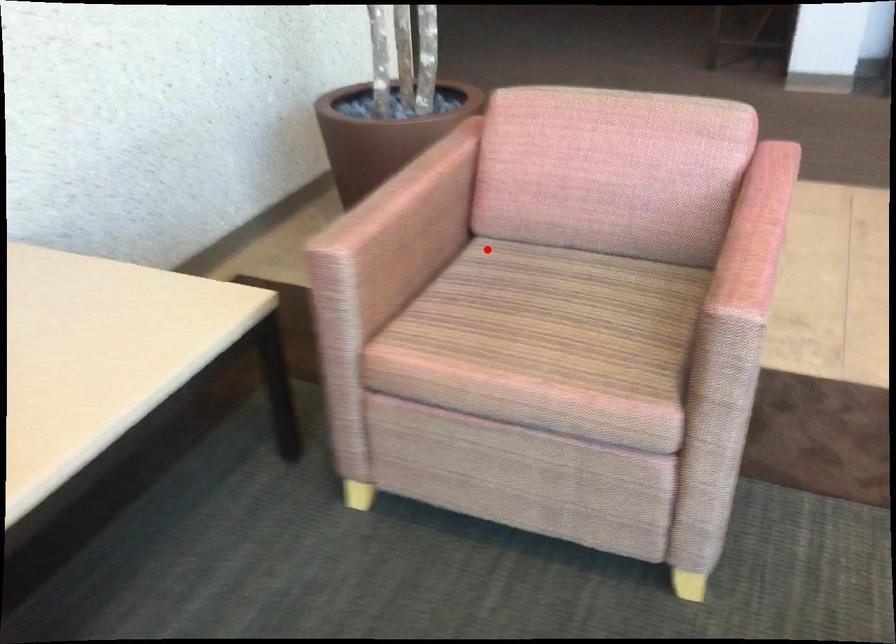
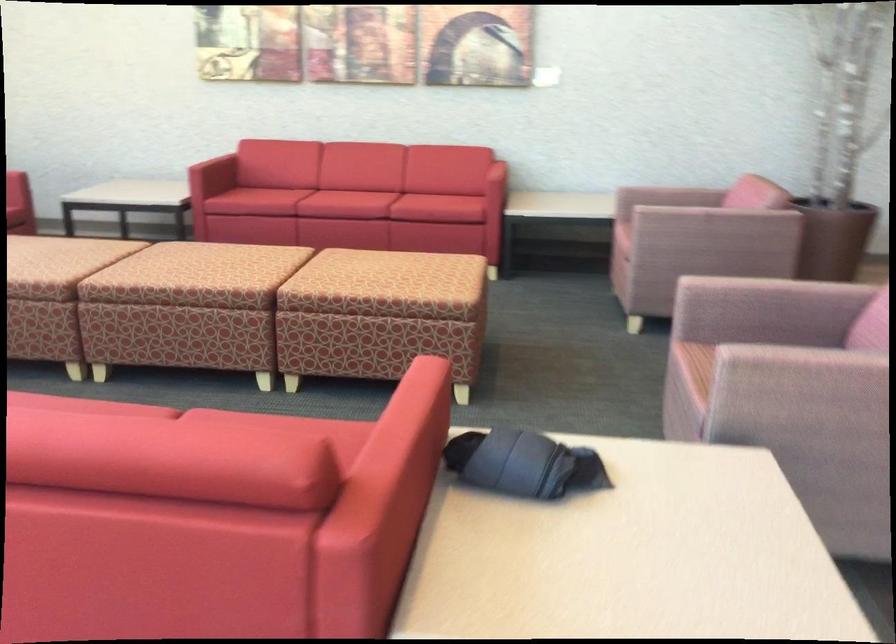
Question: I am providing you with two images of the same scene from different viewpoints. Given a red point in image1, look at the same physical point in image2. Is it:

Choices:
 (A) Closer to the viewpoint
 (B) Farther from the viewpoint

Answer: (B)